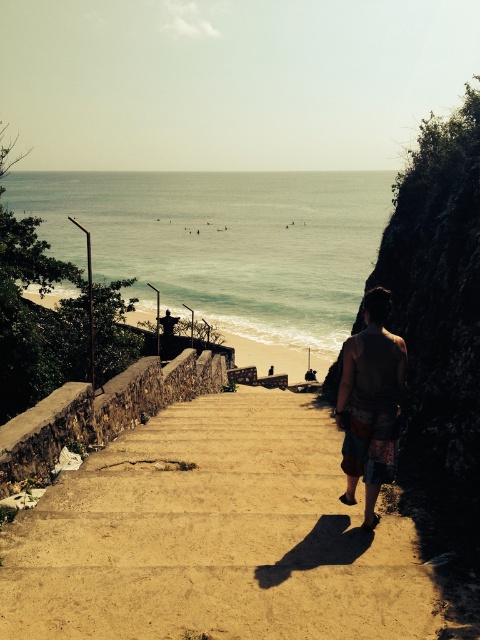
Question: Does brown concrete stairs at center appear over brown fabric bag at center?

Choices:
 (A) no
 (B) yes

Answer: (A)

Question: Estimate the real-world distances between objects in this image. Which object is farther from the smooth concrete stairs at center?

Choices:
 (A) greenish-blue water at center
 (B) brown concrete stairs at center
 (C) brown fabric bag at center

Answer: (A)

Question: Considering the real-world distances, which object is closest to the brown concrete stairs at center?

Choices:
 (A) greenish-blue water at center
 (B) brown fabric bag at center
 (C) smooth concrete stairs at center

Answer: (B)

Question: Among these points, which one is nearest to the camera?

Choices:
 (A) click(286, 353)
 (B) click(367, 458)
 (C) click(326, 586)

Answer: (C)

Question: Considering the relative positions of brown concrete stairs at center and greenish-blue water at center in the image provided, where is brown concrete stairs at center located with respect to greenish-blue water at center?

Choices:
 (A) right
 (B) left

Answer: (B)

Question: Is brown concrete stairs at center to the left of greenish-blue water at center from the viewer's perspective?

Choices:
 (A) no
 (B) yes

Answer: (B)